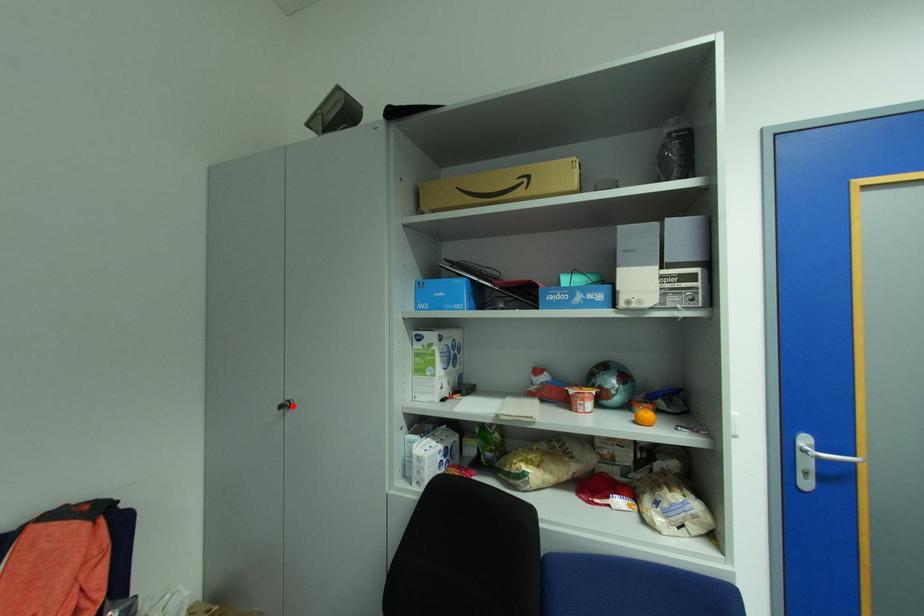
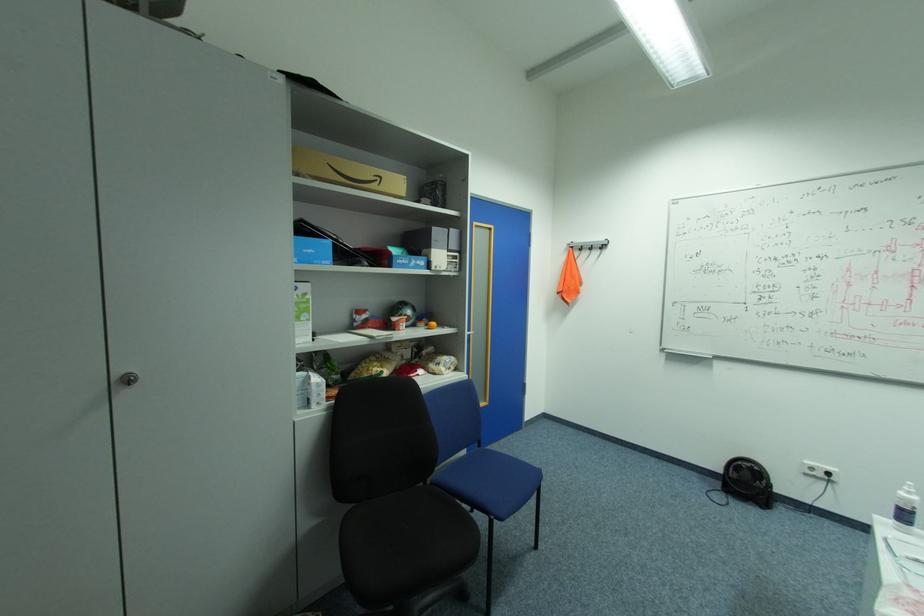
The point at the highlighted location is marked in the first image. Where is the corresponding point in the second image?

(137, 379)